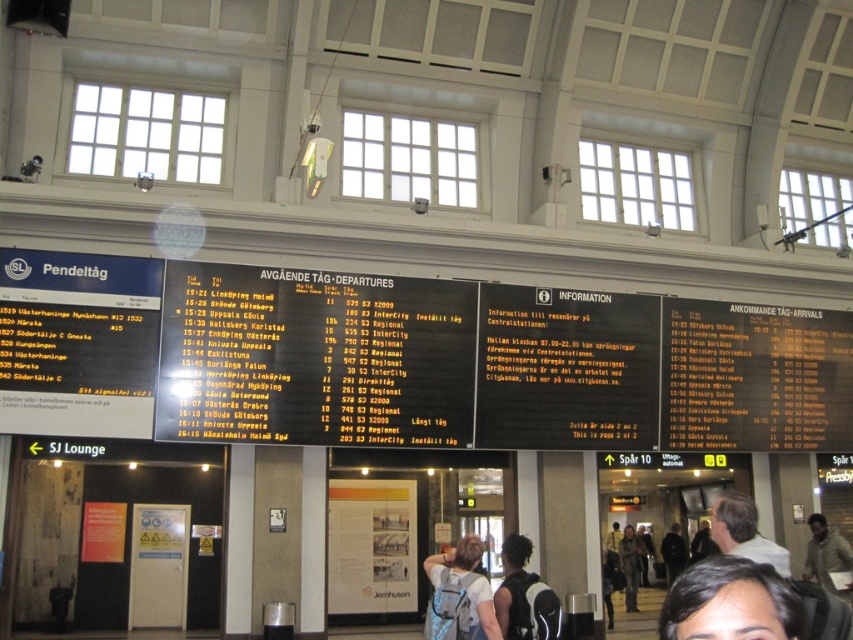
Who is more distant from viewer, (670, 605) or (740, 547)?

The point (740, 547) is behind.

In the scene shown: Is dark brown hair at lower right closer to the viewer compared to light brown hair at center?

Yes, it is.

Does point (688, 580) lie behind point (741, 534)?

No, it is not.

Locate an element on the screen. dark brown hair at lower right is located at coordinates (729, 602).

Describe the element at coordinates (407, 360) in the screenshot. I see `black matte departure board at center` at that location.

Between point (492, 328) and point (668, 608), which one is positioned behind?

Positioned behind is point (492, 328).

Identify the location of black matte departure board at center. click(407, 360).

From the picture: Is black matte departure board at center taller than light blue backpack at center?

Yes.

Based on the photo, can you confirm if black matte departure board at center is positioned to the left of light blue backpack at center?

In fact, black matte departure board at center is to the right of light blue backpack at center.

At what (x,y) coordinates should I click in order to perform the action: click on black matte departure board at center. Please return your answer as a coordinate pair (x, y). Looking at the image, I should click on (407, 360).